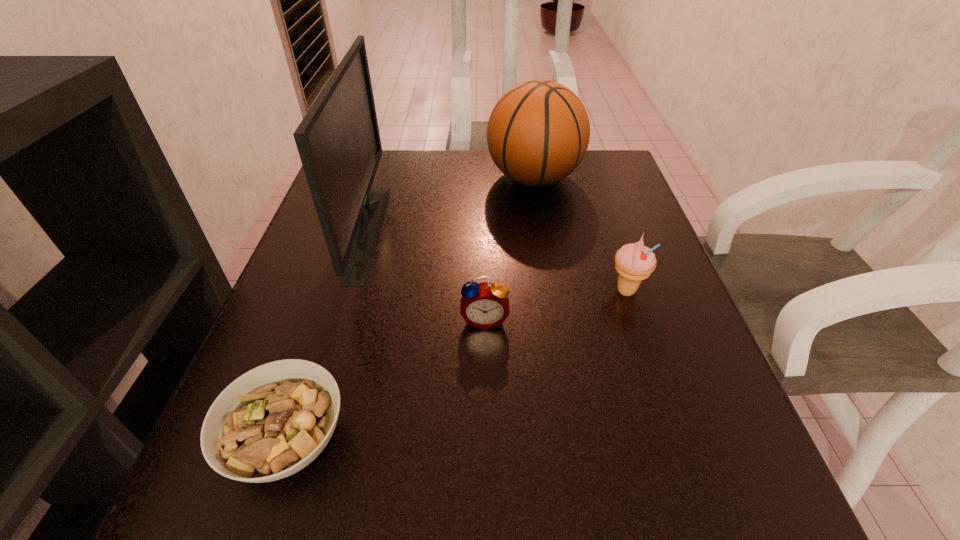
You are a GUI agent. You are given a task and a screenshot of the screen. Output one action in this format:
    pyautogui.click(x=<x>, y=<y>)
    Task: Click on the monitor
    The image size is (960, 540).
    Given the screenshot: What is the action you would take?
    pos(338,140)

Identify the location of the second tallest object. This screenshot has height=540, width=960. (538, 132).

Find the location of a particular element. icecream is located at coordinates (634, 262).

Where is `alarm clock`? This screenshot has width=960, height=540. alarm clock is located at coordinates (x=484, y=305).

This screenshot has width=960, height=540. In order to click on the second nearest object in this screenshot , I will do `click(484, 305)`.

This screenshot has width=960, height=540. Find the location of `the nearest object`. the nearest object is located at coordinates (271, 422).

Where is `the shortest object`? The width and height of the screenshot is (960, 540). the shortest object is located at coordinates (271, 422).

Locate an element on the screen. The width and height of the screenshot is (960, 540). vacant space located 0.280m on the front-facing side of the monitor is located at coordinates (508, 231).

Identify the location of free space located 0.130m on the front of the fourth shortest object. The width and height of the screenshot is (960, 540). (544, 240).

Locate an element on the screen. This screenshot has width=960, height=540. free space located 0.370m on the left of the icecream is located at coordinates (412, 291).